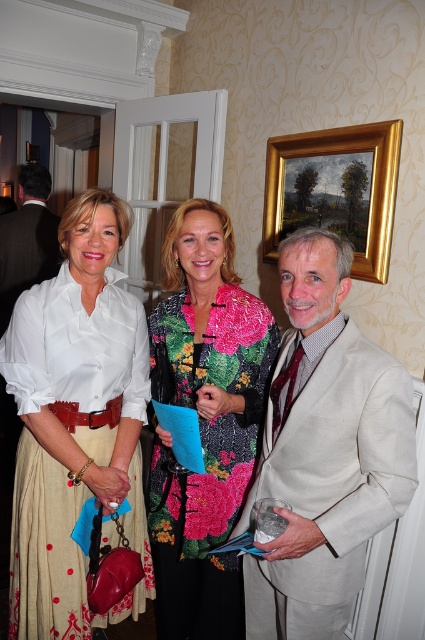
Question: Is goldmaterial/texturepicture frame at upper center further to camera compared to matte black suit at center?

Choices:
 (A) yes
 (B) no

Answer: (B)

Question: Observing the image, what is the correct spatial positioning of light beige suit at center in reference to floral sequined jacket at center?

Choices:
 (A) right
 (B) left

Answer: (A)

Question: Which object is closer to the camera taking this photo?

Choices:
 (A) light beige suit at center
 (B) goldmaterial/texturepicture frame at upper center
 (C) matte white blouse at center
 (D) floral sequined jacket at center

Answer: (A)

Question: Among these points, which one is farthest from the camera?

Choices:
 (A) (382, 220)
 (B) (169, 332)
 (C) (56, 458)
 (D) (368, 392)

Answer: (A)

Question: Is the position of floral sequined jacket at center more distant than that of matte black suit at center?

Choices:
 (A) no
 (B) yes

Answer: (A)

Question: Which object is farther from the camera taking this photo?

Choices:
 (A) light beige suit at center
 (B) goldmaterial/texturepicture frame at upper center
 (C) matte white blouse at center
 (D) matte black suit at center

Answer: (D)